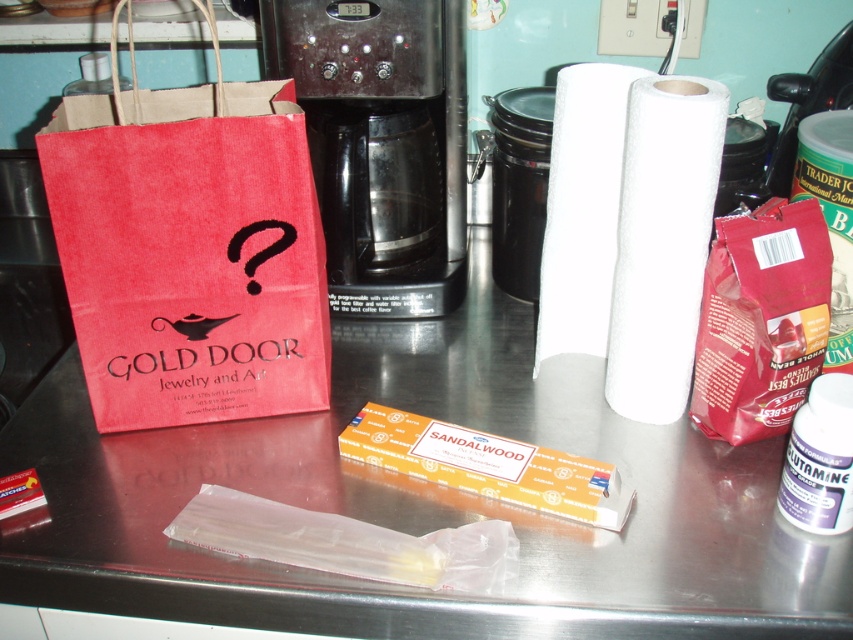
Is matte paper bag at left taller than black plastic container at center?

Correct, matte paper bag at left is much taller as black plastic container at center.

Is point (297, 109) positioned after point (544, 198)?

No, (297, 109) is closer to viewer.

Where is `matte paper bag at left`? The height and width of the screenshot is (640, 853). matte paper bag at left is located at coordinates (189, 248).

Locate an element on the screen. This screenshot has height=640, width=853. metallic silver table at center is located at coordinates (421, 502).

Can you confirm if metallic silver table at center is positioned above black plastic coffee machine at center?

Actually, metallic silver table at center is below black plastic coffee machine at center.

The image size is (853, 640). I want to click on metallic silver table at center, so click(421, 502).

You are a GUI agent. You are given a task and a screenshot of the screen. Output one action in this format:
    pyautogui.click(x=<x>, y=<y>)
    Task: Click on the metallic silver table at center
    The height and width of the screenshot is (640, 853).
    Given the screenshot: What is the action you would take?
    pyautogui.click(x=421, y=502)

Who is higher up, black plastic coffee machine at center or white matte paper towel at center?

black plastic coffee machine at center is higher up.

Can you confirm if black plastic coffee machine at center is smaller than white matte paper towel at center?

Actually, black plastic coffee machine at center might be larger than white matte paper towel at center.

Between point (306, 67) and point (660, 321), which one is positioned in front?

Point (660, 321) is more forward.

Find the location of a particular element. The width and height of the screenshot is (853, 640). black plastic coffee machine at center is located at coordinates (381, 145).